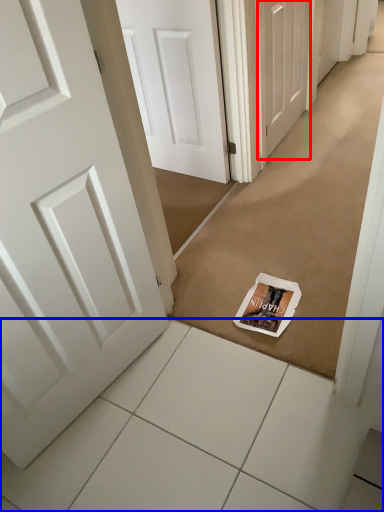
Question: Which of the following is the farthest to the observer, door (highlighted by a red box) or tile (highlighted by a blue box)?

Choices:
 (A) door
 (B) tile

Answer: (A)